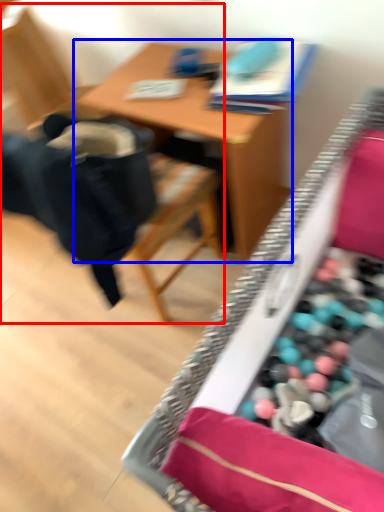
Question: Which object appears closest to the camera in this image, chair (highlighted by a red box) or table (highlighted by a blue box)?

Choices:
 (A) chair
 (B) table

Answer: (A)